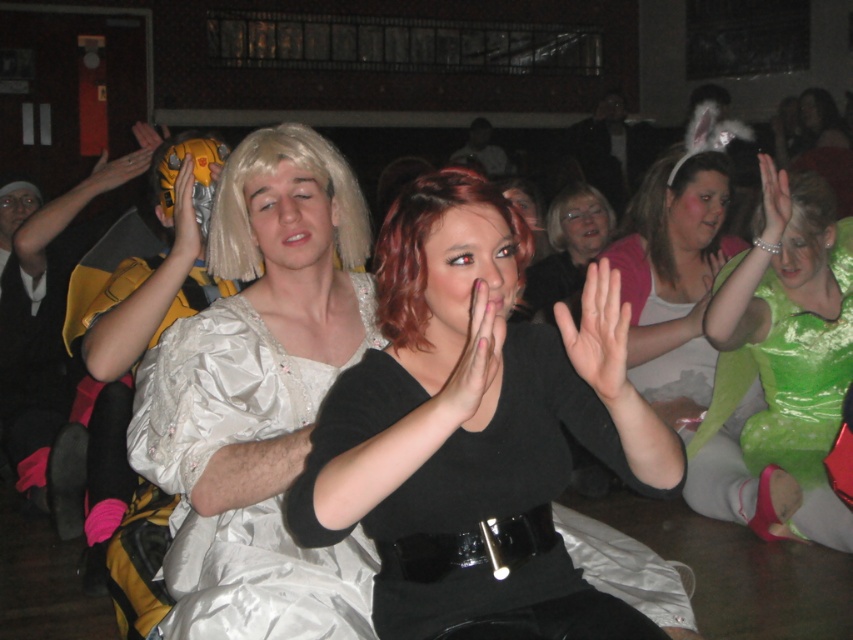
In the scene shown: You are a photographer at the event and need to capture a closeup of the blonde synthetic wig at center and the black matte hand at center. Which object should you zoom in on more to ensure both are in focus?

The blonde synthetic wig at center is wider than the black matte hand at center, so you should zoom in more on the blonde synthetic wig at center to ensure both are in focus.

You are at a costume party and see the smooth green hand at upper right and the white matte wig at center. Which object is positioned lower in the scene?

The smooth green hand at upper right is positioned below the white matte wig at center, so it is lower in the scene.

You are at a costume party and notice two items of clothing. The green shiny dress at center and the matte yellow glove at upper left. Which one is bigger in size?

The green shiny dress at center is larger in size compared to the matte yellow glove at upper left.